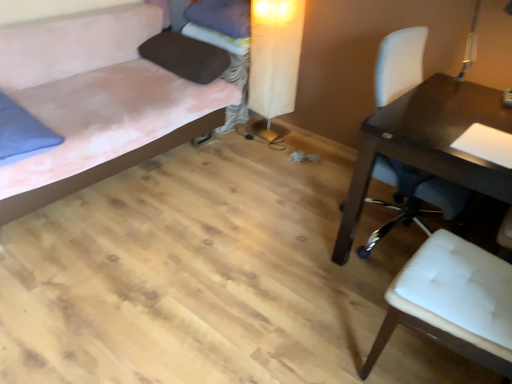
The height and width of the screenshot is (384, 512). What do you see at coordinates (414, 197) in the screenshot? I see `white leather chair at right, which ranks as the second chair in front-to-back order` at bounding box center [414, 197].

Find the location of a particular element. brown fabric pillow at upper center, the second pillow positioned from the bottom is located at coordinates (186, 57).

Where is `blue fabric pillow at left, marked as the 3th pillow in a top-to-bottom arrangement`? Image resolution: width=512 pixels, height=384 pixels. blue fabric pillow at left, marked as the 3th pillow in a top-to-bottom arrangement is located at coordinates (22, 133).

Considering the relative sizes of white leather chair at right, the first chair from the front, and brown fabric pillow at upper center, the second pillow positioned from the bottom, in the image provided, is white leather chair at right, the first chair from the front, shorter than brown fabric pillow at upper center, the second pillow positioned from the bottom,?

No, white leather chair at right, the first chair from the front, is not shorter than brown fabric pillow at upper center, the second pillow positioned from the bottom.

Which is nearer, (450, 290) or (220, 61)?

Point (450, 290).

From the image's perspective, is white leather chair at right, the first chair from the front, below brown fabric pillow at upper center, the 2th pillow positioned from the top?

Correct, white leather chair at right, the first chair from the front, appears lower than brown fabric pillow at upper center, the 2th pillow positioned from the top, in the image.

Is white leather chair at right, the first chair from the front, inside or outside of brown fabric pillow at upper center, the second pillow positioned from the bottom?

white leather chair at right, the first chair from the front, is located beyond the bounds of brown fabric pillow at upper center, the second pillow positioned from the bottom.

Does blue fabric pillow at left, the first pillow in the bottom-to-top sequence, have a lesser width compared to beige fabric table lamp at center?

No.

Based on their positions, is blue fabric pillow at left, marked as the 3th pillow in a top-to-bottom arrangement, located to the left or right of beige fabric table lamp at center?

blue fabric pillow at left, marked as the 3th pillow in a top-to-bottom arrangement, is to the left of beige fabric table lamp at center.

Could you tell me if blue fabric pillow at left, marked as the 3th pillow in a top-to-bottom arrangement, is turned towards beige fabric table lamp at center?

No, blue fabric pillow at left, marked as the 3th pillow in a top-to-bottom arrangement, is not aimed at beige fabric table lamp at center.

Is blue fabric pillow at left, marked as the 3th pillow in a top-to-bottom arrangement, bigger or smaller than beige fabric table lamp at center?

blue fabric pillow at left, marked as the 3th pillow in a top-to-bottom arrangement, is smaller than beige fabric table lamp at center.

From the image's perspective, is beige fabric table lamp at center below suede-like pink bed at left?

Actually, beige fabric table lamp at center appears above suede-like pink bed at left in the image.

Is beige fabric table lamp at center facing away from suede-like pink bed at left?

beige fabric table lamp at center does not have its back to suede-like pink bed at left.

Between beige fabric table lamp at center and suede-like pink bed at left, which one has smaller size?

Smaller between the two is beige fabric table lamp at center.

Is the surface of brown fabric pillow at upper center, the 2th pillow positioned from the top, in direct contact with purple fabric pillow at upper center, placed as the 1th pillow when sorted from top to bottom?

They are not placed beside each other.

Does brown fabric pillow at upper center, the second pillow positioned from the bottom, have a greater width compared to purple fabric pillow at upper center, placed as the 1th pillow when sorted from top to bottom?

Indeed, brown fabric pillow at upper center, the second pillow positioned from the bottom, has a greater width compared to purple fabric pillow at upper center, placed as the 1th pillow when sorted from top to bottom.

From a real-world perspective, is brown fabric pillow at upper center, the second pillow positioned from the bottom, under purple fabric pillow at upper center, placed as the 1th pillow when sorted from top to bottom?

Correct, in the physical world, brown fabric pillow at upper center, the second pillow positioned from the bottom, is lower than purple fabric pillow at upper center, placed as the 1th pillow when sorted from top to bottom.

At what (x,y) coordinates should I click in order to perform the action: click on pillow that appears above the brown fabric pillow at upper center, the 2th pillow positioned from the top (from a real-world perspective). Please return your answer as a coordinate pair (x, y). Looking at the image, I should click on (221, 16).

Is purple fabric pillow at upper center, placed as the 1th pillow when sorted from top to bottom, shorter than brown fabric pillow at upper center, the 2th pillow positioned from the top?

In fact, purple fabric pillow at upper center, placed as the 1th pillow when sorted from top to bottom, may be taller than brown fabric pillow at upper center, the 2th pillow positioned from the top.

What's the angular difference between purple fabric pillow at upper center, placed as the 1th pillow when sorted from top to bottom, and brown fabric pillow at upper center, the second pillow positioned from the bottom,'s facing directions?

90.3 degrees separate the facing orientations of purple fabric pillow at upper center, placed as the 1th pillow when sorted from top to bottom, and brown fabric pillow at upper center, the second pillow positioned from the bottom.

Looking at this image, can brown fabric pillow at upper center, the 2th pillow positioned from the top, be found inside purple fabric pillow at upper center, the 3th pillow positioned from the bottom?

Actually, brown fabric pillow at upper center, the 2th pillow positioned from the top, is outside purple fabric pillow at upper center, the 3th pillow positioned from the bottom.

Is point (226, 1) positioned before point (181, 60)?

No, it is not.

Considering the sizes of blue fabric pillow at left, the first pillow in the bottom-to-top sequence, and suede-like pink bed at left in the image, is blue fabric pillow at left, the first pillow in the bottom-to-top sequence, taller or shorter than suede-like pink bed at left?

Clearly, blue fabric pillow at left, the first pillow in the bottom-to-top sequence, is shorter compared to suede-like pink bed at left.

Looking at their sizes, would you say blue fabric pillow at left, the first pillow in the bottom-to-top sequence, is wider or thinner than suede-like pink bed at left?

In the image, blue fabric pillow at left, the first pillow in the bottom-to-top sequence, appears to be more narrow than suede-like pink bed at left.

Is blue fabric pillow at left, the first pillow in the bottom-to-top sequence, with suede-like pink bed at left?

blue fabric pillow at left, the first pillow in the bottom-to-top sequence, is not next to suede-like pink bed at left, and they're not touching.

Does blue fabric pillow at left, the first pillow in the bottom-to-top sequence, turn towards suede-like pink bed at left?

Yes, blue fabric pillow at left, the first pillow in the bottom-to-top sequence, is oriented towards suede-like pink bed at left.

From a real-world perspective, is suede-like pink bed at left on top of white leather chair at right, the 1th chair viewed from the back?

No, from a real-world perspective, suede-like pink bed at left is not on top of white leather chair at right, the 1th chair viewed from the back.

What are the coordinates of `chair that is the 1st one when counting forward from the suede-like pink bed at left` in the screenshot? It's located at (414, 197).

Considering the positions of objects suede-like pink bed at left and white leather chair at right, which ranks as the second chair in front-to-back order, in the image provided, who is more to the left, suede-like pink bed at left or white leather chair at right, which ranks as the second chair in front-to-back order,?

suede-like pink bed at left.

Is suede-like pink bed at left wider than white leather chair at right, which ranks as the second chair in front-to-back order?

Indeed, suede-like pink bed at left has a greater width compared to white leather chair at right, which ranks as the second chair in front-to-back order.

Find the location of a particular element. Image resolution: width=512 pixels, height=384 pixels. the 2nd pillow behind the white leather chair at right, which is counted as the 2th chair, starting from the back is located at coordinates (186, 57).

Image resolution: width=512 pixels, height=384 pixels. What are the coordinates of `table lamp on the right of the blue fabric pillow at left, marked as the 3th pillow in a top-to-bottom arrangement` in the screenshot? It's located at (274, 63).

Based on their spatial positions, is blue fabric pillow at left, marked as the 3th pillow in a top-to-bottom arrangement, or suede-like pink bed at left closer to white leather chair at right, which ranks as the second chair in front-to-back order?

Based on the image, suede-like pink bed at left appears to be nearer to white leather chair at right, which ranks as the second chair in front-to-back order.

From the image, which object appears to be farther from white leather chair at right, which is counted as the 2th chair, starting from the back, brown fabric pillow at upper center, the second pillow positioned from the bottom, or purple fabric pillow at upper center, the 3th pillow positioned from the bottom?

purple fabric pillow at upper center, the 3th pillow positioned from the bottom, is further to white leather chair at right, which is counted as the 2th chair, starting from the back.

From the image, which object appears to be farther from white leather chair at right, the 1th chair viewed from the back, purple fabric pillow at upper center, placed as the 1th pillow when sorted from top to bottom, or suede-like pink bed at left?

Based on the image, suede-like pink bed at left appears to be further to white leather chair at right, the 1th chair viewed from the back.

Considering their positions, is brown fabric pillow at upper center, the second pillow positioned from the bottom, positioned closer to white leather chair at right, the 1th chair viewed from the back, than blue fabric pillow at left, the first pillow in the bottom-to-top sequence?

brown fabric pillow at upper center, the second pillow positioned from the bottom.

Looking at the image, which one is located further to white leather chair at right, which ranks as the second chair in front-to-back order, blue fabric pillow at left, marked as the 3th pillow in a top-to-bottom arrangement, or beige fabric table lamp at center?

blue fabric pillow at left, marked as the 3th pillow in a top-to-bottom arrangement, lies further to white leather chair at right, which ranks as the second chair in front-to-back order, than the other object.

Estimate the real-world distances between objects in this image. Which object is further from blue fabric pillow at left, marked as the 3th pillow in a top-to-bottom arrangement, suede-like pink bed at left or brown fabric pillow at upper center, the second pillow positioned from the bottom?

brown fabric pillow at upper center, the second pillow positioned from the bottom, is positioned further to the anchor blue fabric pillow at left, marked as the 3th pillow in a top-to-bottom arrangement.

When comparing their distances from white leather chair at right, which ranks as the second chair in front-to-back order, does purple fabric pillow at upper center, placed as the 1th pillow when sorted from top to bottom, or blue fabric pillow at left, marked as the 3th pillow in a top-to-bottom arrangement, seem further?

Among the two, blue fabric pillow at left, marked as the 3th pillow in a top-to-bottom arrangement, is located further to white leather chair at right, which ranks as the second chair in front-to-back order.

Which object lies nearer to the anchor point white leather chair at right, which ranks as the second chair in front-to-back order, brown fabric pillow at upper center, the second pillow positioned from the bottom, or purple fabric pillow at upper center, the 3th pillow positioned from the bottom?

brown fabric pillow at upper center, the second pillow positioned from the bottom.

You are a GUI agent. You are given a task and a screenshot of the screen. Output one action in this format:
    pyautogui.click(x=<x>, y=<y>)
    Task: Click on the pillow between suede-like pink bed at left and brown fabric pillow at upper center, the 2th pillow positioned from the top, from front to back
    This screenshot has height=384, width=512.
    Given the screenshot: What is the action you would take?
    pyautogui.click(x=22, y=133)

I want to click on table lamp between suede-like pink bed at left and white leather chair at right, the 1th chair viewed from the back, from left to right, so 274,63.

The image size is (512, 384). I want to click on pillow between blue fabric pillow at left, marked as the 3th pillow in a top-to-bottom arrangement, and purple fabric pillow at upper center, the 3th pillow positioned from the bottom, in the front-back direction, so click(186, 57).

This screenshot has height=384, width=512. I want to click on chair between suede-like pink bed at left and white leather chair at right, the 1th chair viewed from the back, in the horizontal direction, so click(x=454, y=300).